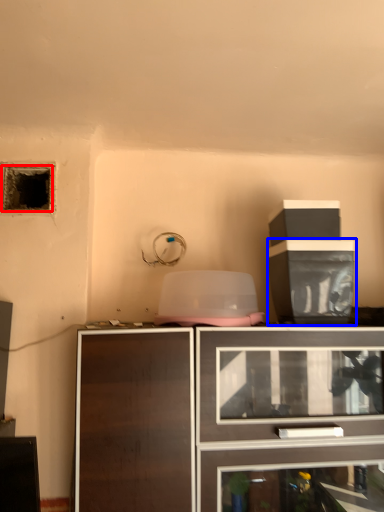
Question: Among these objects, which one is farthest to the camera, hole (highlighted by a red box) or cabinetry (highlighted by a blue box)?

Choices:
 (A) hole
 (B) cabinetry

Answer: (A)